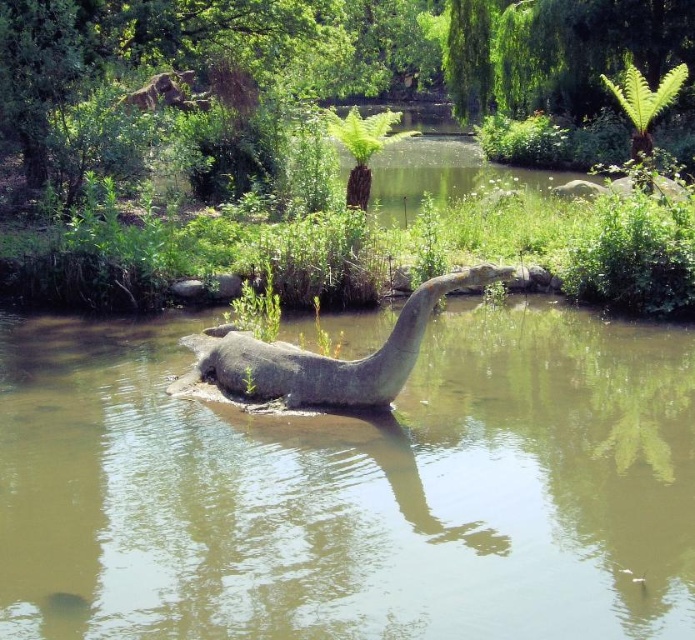
You are standing at the point marked by the coordinates (352, 488) in the image. Looking around, you see the statue resembling a long necked dinosaur partially submerged in the water. What color is the water you are standing in?

The water at the marked point is greenish brown in color.